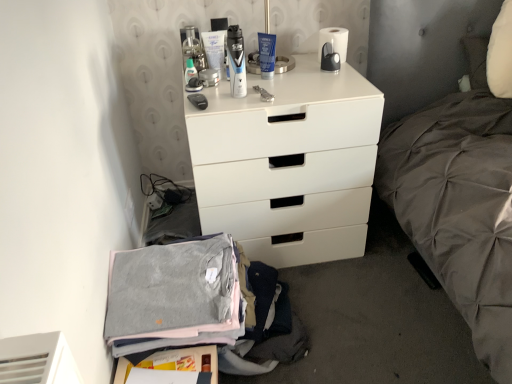
Where is `free point in front of translucent plastic bottle at upper center`? Image resolution: width=512 pixels, height=384 pixels. free point in front of translucent plastic bottle at upper center is located at coordinates (212, 99).